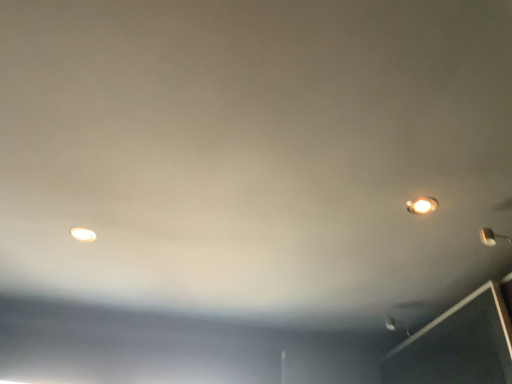
The width and height of the screenshot is (512, 384). Identify the location of white glossy lamp at upper left. point(83,234).

The height and width of the screenshot is (384, 512). Describe the element at coordinates (83, 234) in the screenshot. I see `white glossy lamp at upper left` at that location.

In order to click on white glossy lamp at upper left in this screenshot , I will do click(83, 234).